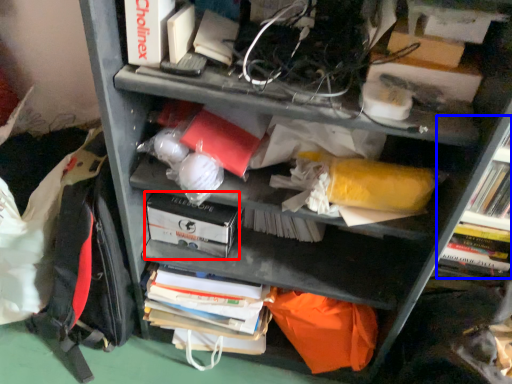
Question: Which point is further to the camera, paperback book (highlighted by a red box) or shelf (highlighted by a blue box)?

Choices:
 (A) paperback book
 (B) shelf

Answer: (A)